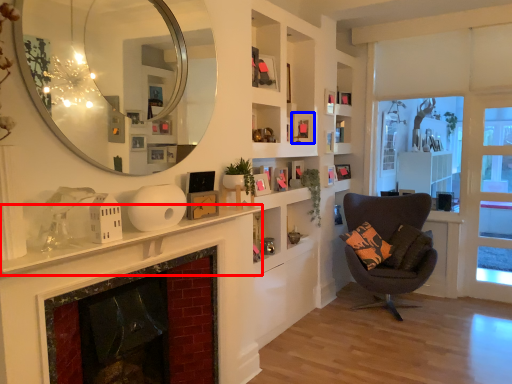
Question: Among these objects, which one is farthest to the camera, mantle (highlighted by a red box) or picture frame (highlighted by a blue box)?

Choices:
 (A) mantle
 (B) picture frame

Answer: (B)